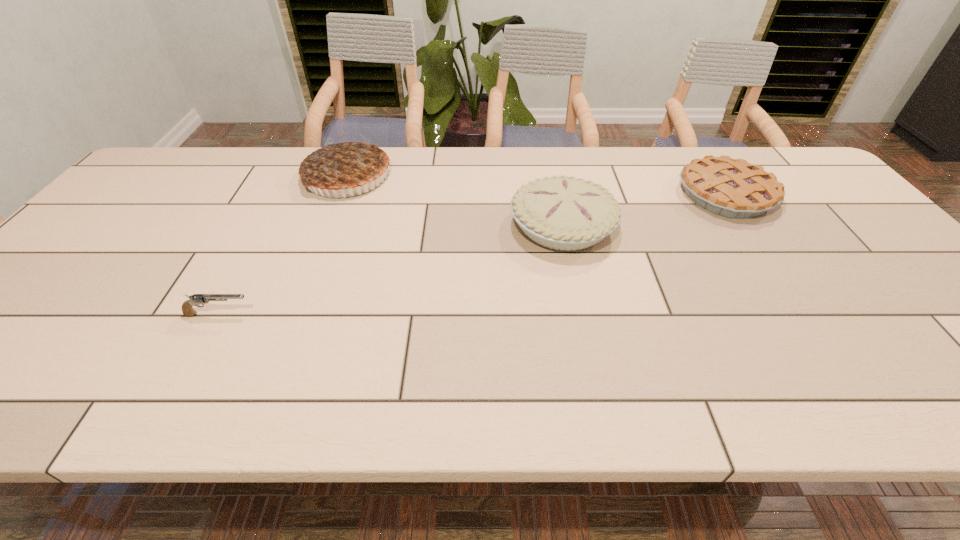
The height and width of the screenshot is (540, 960). In order to click on free space between the nearest object and the rightmost object in this screenshot , I will do `click(472, 254)`.

At what (x,y) coordinates should I click in order to perform the action: click on vacant point located between the nearest object and the tallest object. Please return your answer as a coordinate pair (x, y). The image size is (960, 540). Looking at the image, I should click on (283, 245).

You are a GUI agent. You are given a task and a screenshot of the screen. Output one action in this format:
    pyautogui.click(x=<x>, y=<y>)
    Task: Click on the free space between the nearest object and the rightmost object
    
    Given the screenshot: What is the action you would take?
    pyautogui.click(x=472, y=254)

Where is `vacant region between the rightmost pie and the nearest object`? vacant region between the rightmost pie and the nearest object is located at coordinates (472, 254).

Where is `the second closest object to the leftmost pie`? The height and width of the screenshot is (540, 960). the second closest object to the leftmost pie is located at coordinates (197, 299).

Choose which object is the second nearest neighbor to the nearest object. Please provide its 2D coordinates. Your answer should be formatted as a tuple, i.e. [(x, y)], where the tuple contains the x and y coordinates of a point satisfying the conditions above.

[(564, 213)]

Find the location of a particular element. pie that is the second closest to the third object from left to right is located at coordinates (345, 163).

Image resolution: width=960 pixels, height=540 pixels. Identify the location of pie object that ranks as the closest to the leftmost pie. (564, 213).

Where is `vacant space that satisfies the following two spatial constraints: 1. on the front side of the rightmost object; 2. aiming along the barrel of the gun`? vacant space that satisfies the following two spatial constraints: 1. on the front side of the rightmost object; 2. aiming along the barrel of the gun is located at coordinates (808, 314).

Find the location of a particular element. The height and width of the screenshot is (540, 960). vacant space that satisfies the following two spatial constraints: 1. on the front side of the rightmost pie; 2. aiming along the barrel of the gun is located at coordinates (808, 314).